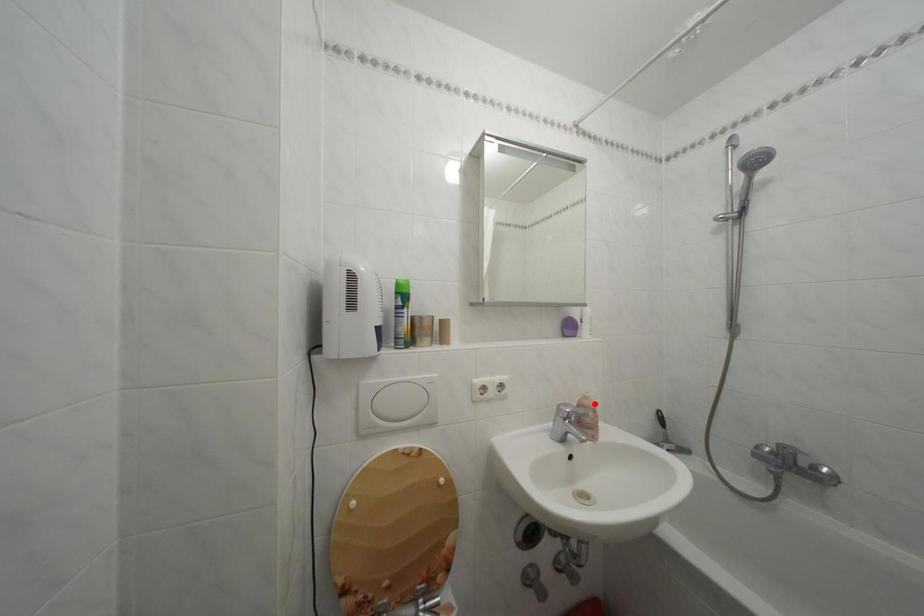
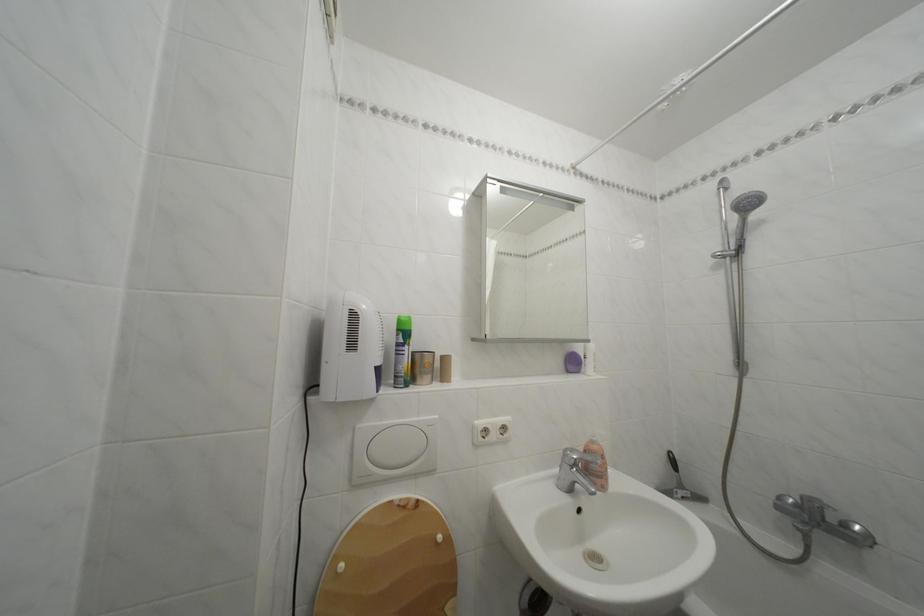
Locate, in the second image, the point that corresponds to the highlighted location in the first image.

(602, 448)